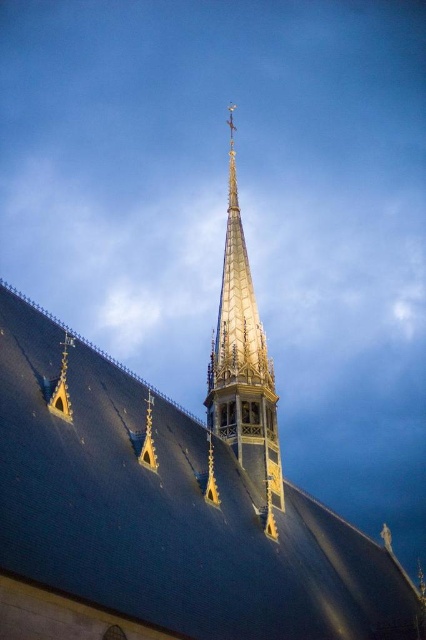
Question: Which point appears farthest from the camera in this image?

Choices:
 (A) (264, 435)
 (B) (54, 369)

Answer: (A)

Question: Is shiny dark gray roof at center to the left of golden-gilt spire at upper center from the viewer's perspective?

Choices:
 (A) yes
 (B) no

Answer: (B)

Question: Is shiny dark gray roof at center wider than golden-gilt spire at upper center?

Choices:
 (A) no
 (B) yes

Answer: (B)

Question: Can you confirm if shiny dark gray roof at center is positioned below golden-gilt spire at upper center?

Choices:
 (A) yes
 (B) no

Answer: (A)

Question: Which point is farther to the camera?

Choices:
 (A) golden-gilt spire at upper center
 (B) shiny dark gray roof at center

Answer: (A)